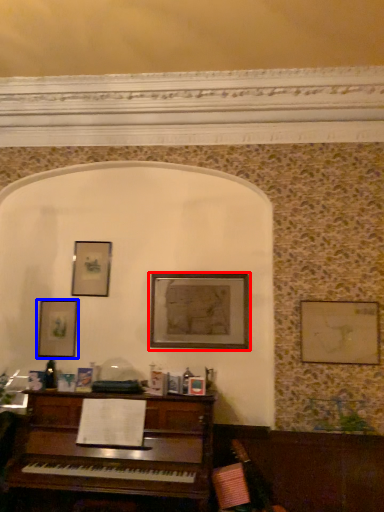
Question: Which object is closer to the camera taking this photo, picture frame (highlighted by a red box) or picture frame (highlighted by a blue box)?

Choices:
 (A) picture frame
 (B) picture frame

Answer: (A)